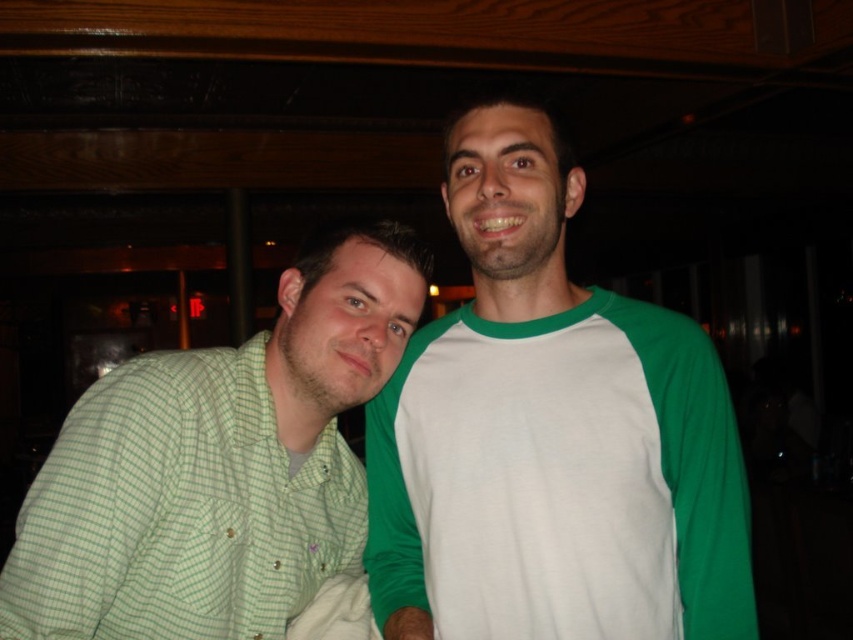
You are standing in a bar and want to reach a point that is 35.32 inches away from your current position. The coordinates of this point are given as point (514, 627). Can you estimate whether you can comfortably reach this point with your outstretched hand?

The distance between you and point (514, 627) is 35.32 inches. Since an average person can comfortably reach about 30 inches with an outstretched hand, this point is beyond your comfortable reach.